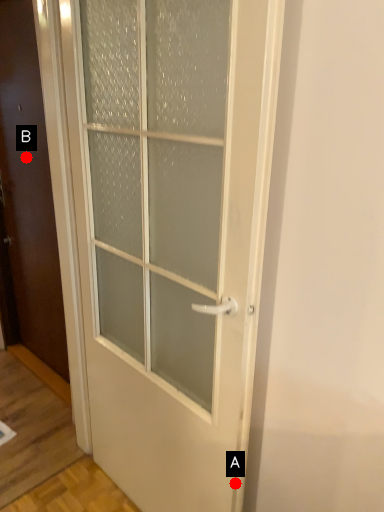
Question: Two points are circled on the image, labeled by A and B beside each circle. Among these points, which one is farthest from the camera?

Choices:
 (A) A is further
 (B) B is further

Answer: (B)